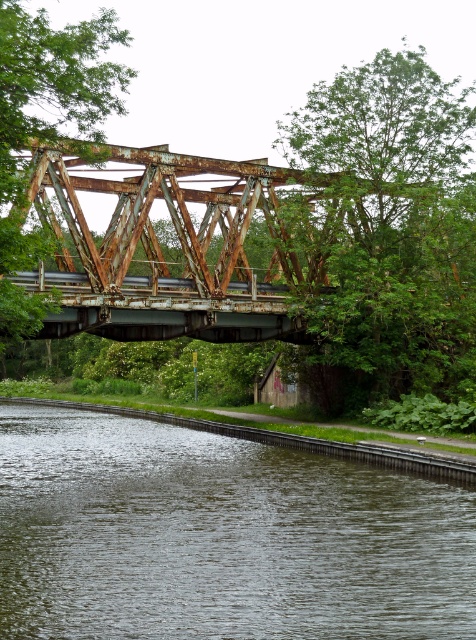
Can you confirm if green leafy tree at upper right is positioned to the left of rusty metal train bridge at center?

Incorrect, green leafy tree at upper right is not on the left side of rusty metal train bridge at center.

Which is behind, point (449, 180) or point (280, 220)?

Positioned behind is point (449, 180).

Locate an element on the screen. green leafy tree at upper right is located at coordinates pos(387,230).

Can you confirm if dark green water at lower left is bigger than rusty metal bridge at center?

No, dark green water at lower left is not bigger than rusty metal bridge at center.

Describe the element at coordinates (219, 538) in the screenshot. The width and height of the screenshot is (476, 640). I see `dark green water at lower left` at that location.

The image size is (476, 640). Describe the element at coordinates (219, 538) in the screenshot. I see `dark green water at lower left` at that location.

What are the coordinates of `dark green water at lower left` in the screenshot? It's located at (219, 538).

Is rusty metal train bridge at center taller than rusty metal bridge at center?

Yes, rusty metal train bridge at center is taller than rusty metal bridge at center.

Who is positioned more to the left, rusty metal train bridge at center or rusty metal bridge at center?

rusty metal bridge at center is more to the left.

Identify the location of rusty metal train bridge at center. (161, 246).

The image size is (476, 640). I want to click on rusty metal train bridge at center, so click(x=161, y=246).